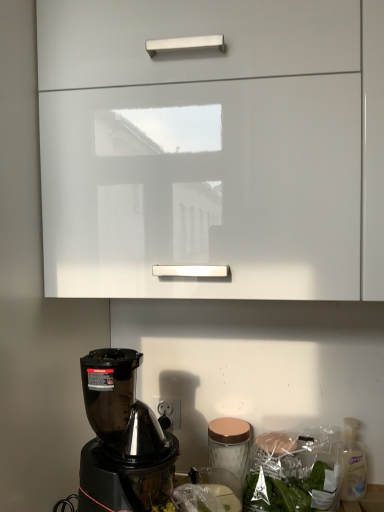
Question: Visually, is clear plastic bottle at lower right positioned to the left or to the right of white glossy cabinet at upper center?

Choices:
 (A) right
 (B) left

Answer: (A)

Question: From the image's perspective, relative to white glossy cabinet at upper center, is clear plastic bottle at lower right above or below?

Choices:
 (A) below
 (B) above

Answer: (A)

Question: Considering the positions of point (349, 474) and point (56, 62), is point (349, 474) closer or farther from the camera than point (56, 62)?

Choices:
 (A) farther
 (B) closer

Answer: (A)

Question: From the image's perspective, is white glossy cabinet at upper center positioned above or below clear plastic bottle at lower right?

Choices:
 (A) below
 (B) above

Answer: (B)

Question: Would you say white glossy cabinet at upper center is inside or outside clear plastic bottle at lower right?

Choices:
 (A) outside
 (B) inside

Answer: (A)

Question: Looking at their shapes, would you say white glossy cabinet at upper center is wider or thinner than clear plastic bottle at lower right?

Choices:
 (A) thin
 (B) wide

Answer: (B)

Question: Relative to clear plastic bottle at lower right, is white glossy cabinet at upper center in front or behind?

Choices:
 (A) front
 (B) behind

Answer: (A)